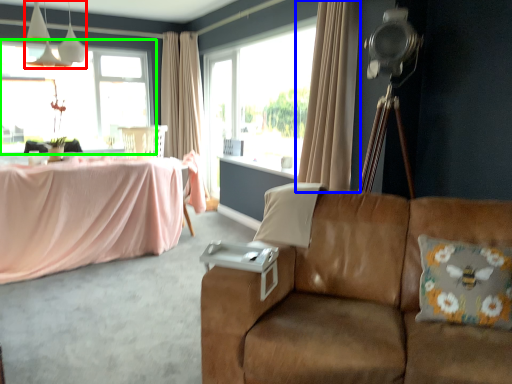
Question: Based on their relative distances, which object is nearer to fixture (highlighted by a red box)? Choose from curtain (highlighted by a blue box) and window (highlighted by a green box).

Choices:
 (A) curtain
 (B) window

Answer: (B)